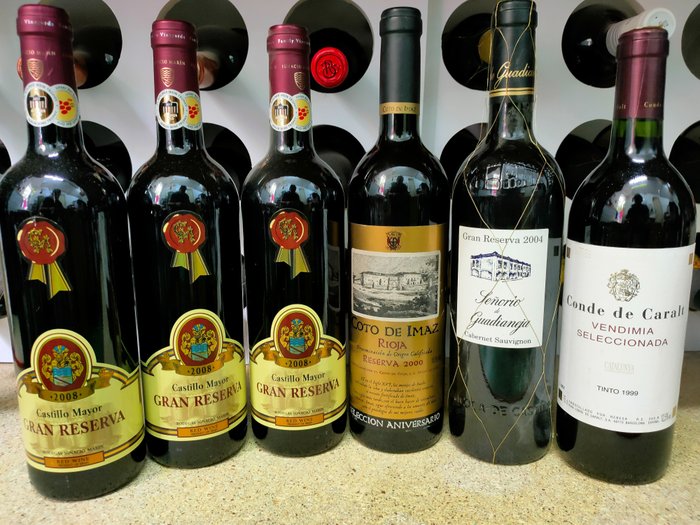
Image resolution: width=700 pixels, height=525 pixels. I want to click on bottle, so click(204, 445).